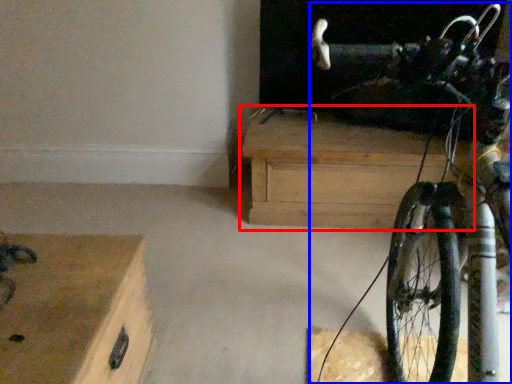
Question: Which point is further to the camera, chest of drawers (highlighted by a red box) or bicycle (highlighted by a blue box)?

Choices:
 (A) chest of drawers
 (B) bicycle

Answer: (A)